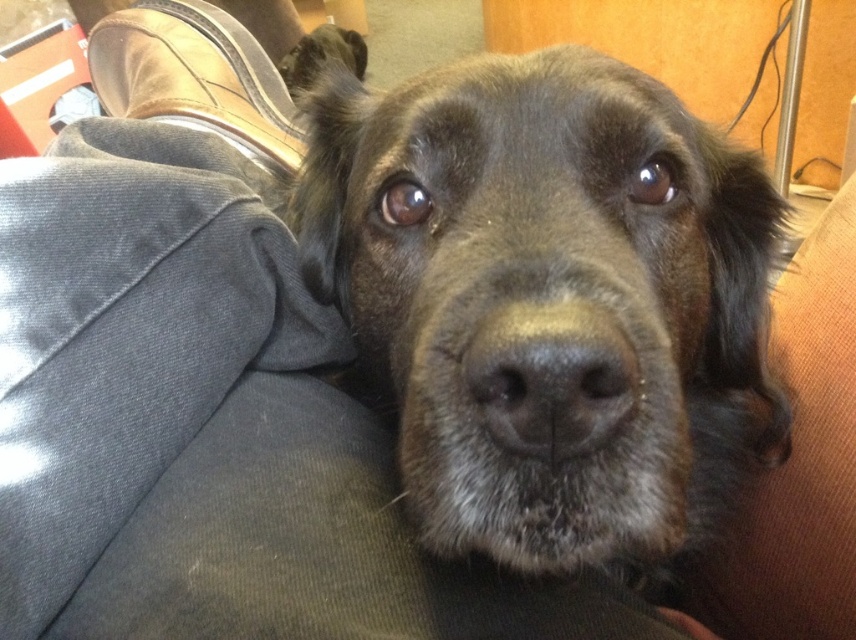
Looking at the scene, can you determine the position of the shiny black fur at center relative to the black matte nose at center?

The shiny black fur at center is located above the black matte nose at center.

A dog is resting its head on a person. The dog has a dark coat with brown and black fur. The person is wearing gray pants and brown shoes. The point at coordinates point (581, 515) is part of a red object in the upper left corner. If the dog wants to reach the red object, can it do so without moving its head from the person?

The distance between the dog and the red object at point (581, 515) is 29.19 centimeters. Since the dog is resting its head on the person, it may not have enough reach to extend its head 29.19 centimeters further to touch the red object without moving.